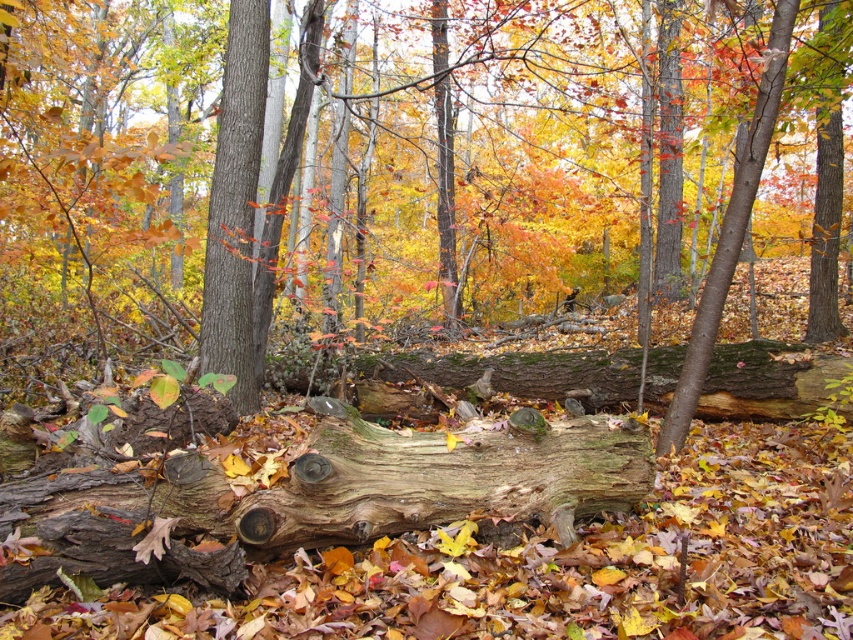
Question: Does weathered wood log at center lie behind smooth brown tree trunk at center?

Choices:
 (A) yes
 (B) no

Answer: (B)

Question: Is weathered wood log at center positioned in front of smooth brown tree trunk at center?

Choices:
 (A) yes
 (B) no

Answer: (A)

Question: Which point is farther to the camera?

Choices:
 (A) (244, 22)
 (B) (184, 490)

Answer: (A)

Question: Which point appears closest to the camera in this image?

Choices:
 (A) (183, 509)
 (B) (225, 65)

Answer: (A)

Question: Does weathered wood log at center appear on the right side of smooth brown tree trunk at center?

Choices:
 (A) no
 (B) yes

Answer: (B)